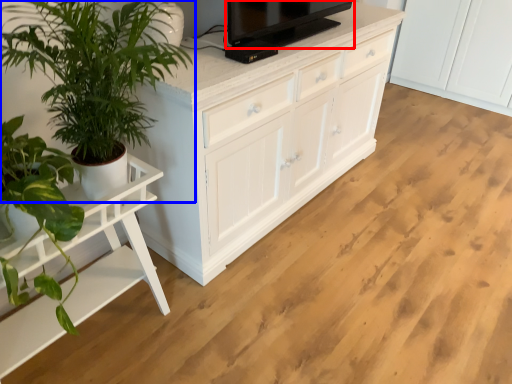
Question: Which of the following is the closest to the observer, television (highlighted by a red box) or houseplant (highlighted by a blue box)?

Choices:
 (A) television
 (B) houseplant

Answer: (B)